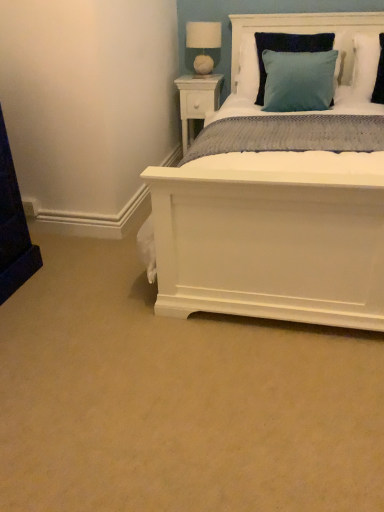
What do you see at coordinates (288, 49) in the screenshot? I see `teal velvet pillow at upper right, placed as the second pillow when sorted from right to left` at bounding box center [288, 49].

Where is `white wood nightstand at upper center`? The image size is (384, 512). white wood nightstand at upper center is located at coordinates (197, 101).

Locate an element on the screen. teal fabric pillow at upper right, placed as the 2th pillow when sorted from left to right is located at coordinates (368, 69).

From a real-world perspective, does white fabric-covered lampshade at upper center stand above teal fabric pillow at upper right, positioned as the first pillow in right-to-left order?

Yes, from a real-world perspective, white fabric-covered lampshade at upper center is on top of teal fabric pillow at upper right, positioned as the first pillow in right-to-left order.

Could you measure the distance between white fabric-covered lampshade at upper center and teal fabric pillow at upper right, placed as the 2th pillow when sorted from left to right?

3.38 feet.

Based on the photo, considering the positions of objects white fabric-covered lampshade at upper center and teal fabric pillow at upper right, placed as the 2th pillow when sorted from left to right, in the image provided, who is more to the left, white fabric-covered lampshade at upper center or teal fabric pillow at upper right, placed as the 2th pillow when sorted from left to right,?

white fabric-covered lampshade at upper center is more to the left.

Could you tell me if white wood nightstand at upper center is turned towards teal fabric pillow at upper right, placed as the 2th pillow when sorted from left to right?

No, white wood nightstand at upper center is not turned towards teal fabric pillow at upper right, placed as the 2th pillow when sorted from left to right.

From the image's perspective, which object appears higher, white wood nightstand at upper center or teal fabric pillow at upper right, positioned as the first pillow in right-to-left order?

teal fabric pillow at upper right, positioned as the first pillow in right-to-left order, from the image's perspective.

Which of these two, white wood nightstand at upper center or teal fabric pillow at upper right, placed as the 2th pillow when sorted from left to right, stands taller?

white wood nightstand at upper center is taller.

At what (x,y) coordinates should I click in order to perform the action: click on table lamp above the white wood headboard at upper center (from the image's perspective). Please return your answer as a coordinate pair (x, y). This screenshot has height=512, width=384. Looking at the image, I should click on (203, 42).

Between white wood headboard at upper center and white fabric-covered lampshade at upper center, which one is positioned in front?

white wood headboard at upper center is more forward.

Is point (315, 19) positioned in front of point (217, 23)?

That is True.

From the image's perspective, is white wood nightstand at upper center above white wood headboard at upper center?

Incorrect, from the image's perspective, white wood nightstand at upper center is lower than white wood headboard at upper center.

Could you tell me if white wood nightstand at upper center is turned towards white wood headboard at upper center?

No, white wood nightstand at upper center is not turned towards white wood headboard at upper center.

Consider the image. Considering the relative sizes of white wood nightstand at upper center and white wood headboard at upper center in the image provided, is white wood nightstand at upper center shorter than white wood headboard at upper center?

Incorrect, the height of white wood nightstand at upper center does not fall short of that of white wood headboard at upper center.

Locate an element on the screen. This screenshot has width=384, height=512. pillow that is the 2nd object located below the white fabric-covered lampshade at upper center (from the image's perspective) is located at coordinates (288, 49).

Is teal velvet pillow at upper right, which appears as the 1th pillow when viewed from the left, outside of white fabric-covered lampshade at upper center?

teal velvet pillow at upper right, which appears as the 1th pillow when viewed from the left, lies outside white fabric-covered lampshade at upper center's area.

What's the angular difference between teal velvet pillow at upper right, which appears as the 1th pillow when viewed from the left, and white fabric-covered lampshade at upper center's facing directions?

1.78 degrees separate the facing orientations of teal velvet pillow at upper right, which appears as the 1th pillow when viewed from the left, and white fabric-covered lampshade at upper center.

Does teal velvet pillow at upper right, which appears as the 1th pillow when viewed from the left, have a smaller size compared to white fabric-covered lampshade at upper center?

Incorrect, teal velvet pillow at upper right, which appears as the 1th pillow when viewed from the left, is not smaller in size than white fabric-covered lampshade at upper center.

Considering the relative positions of teal fabric pillow at upper right, positioned as the first pillow in right-to-left order, and white wood nightstand at upper center in the image provided, is teal fabric pillow at upper right, positioned as the first pillow in right-to-left order, in front of white wood nightstand at upper center?

Yes, the depth of teal fabric pillow at upper right, positioned as the first pillow in right-to-left order, is less than that of white wood nightstand at upper center.

From the image's perspective, which object appears higher, teal fabric pillow at upper right, positioned as the first pillow in right-to-left order, or white wood nightstand at upper center?

teal fabric pillow at upper right, positioned as the first pillow in right-to-left order.

Where is `pillow lying above the white wood nightstand at upper center (from the image's perspective)`? The image size is (384, 512). pillow lying above the white wood nightstand at upper center (from the image's perspective) is located at coordinates (368, 69).

Between point (357, 42) and point (213, 104), which one is positioned behind?

The point (213, 104) is more distant.

Does teal velvet pillow at upper right, which appears as the 1th pillow when viewed from the left, turn towards white wood headboard at upper center?

No, teal velvet pillow at upper right, which appears as the 1th pillow when viewed from the left, is not aimed at white wood headboard at upper center.

Can you confirm if teal velvet pillow at upper right, placed as the second pillow when sorted from right to left, is taller than white wood headboard at upper center?

No.

Is teal velvet pillow at upper right, which appears as the 1th pillow when viewed from the left, next to white wood headboard at upper center?

No, teal velvet pillow at upper right, which appears as the 1th pillow when viewed from the left, is not beside white wood headboard at upper center.

From the image's perspective, between teal velvet pillow at upper right, placed as the second pillow when sorted from right to left, and white wood headboard at upper center, who is located below?

teal velvet pillow at upper right, placed as the second pillow when sorted from right to left, is shown below in the image.

From a real-world perspective, which pillow is the 1st one underneath the white fabric-covered lampshade at upper center? Please provide its 2D coordinates.

[(368, 69)]

Identify the location of pillow above the white wood nightstand at upper center (from the image's perspective). (368, 69).

Based on their spatial positions, is teal fabric pillow at upper right, placed as the 2th pillow when sorted from left to right, or teal velvet pillow at upper right, which appears as the 1th pillow when viewed from the left, closer to white fabric-covered lampshade at upper center?

Among the two, teal velvet pillow at upper right, which appears as the 1th pillow when viewed from the left, is located nearer to white fabric-covered lampshade at upper center.

Looking at the image, which one is located closer to teal fabric pillow at upper right, placed as the 2th pillow when sorted from left to right, white wood nightstand at upper center or teal velvet pillow at upper right, placed as the second pillow when sorted from right to left?

teal velvet pillow at upper right, placed as the second pillow when sorted from right to left, is closer to teal fabric pillow at upper right, placed as the 2th pillow when sorted from left to right.

When comparing their distances from white wood headboard at upper center, does teal fabric pillow at upper right, positioned as the first pillow in right-to-left order, or teal velvet pillow at upper right, placed as the second pillow when sorted from right to left, seem further?

teal velvet pillow at upper right, placed as the second pillow when sorted from right to left, is positioned further to the anchor white wood headboard at upper center.

From the image, which object appears to be farther from teal fabric pillow at upper right, placed as the 2th pillow when sorted from left to right, white fabric-covered lampshade at upper center or teal velvet pillow at upper right, which appears as the 1th pillow when viewed from the left?

white fabric-covered lampshade at upper center lies further to teal fabric pillow at upper right, placed as the 2th pillow when sorted from left to right, than the other object.

From the image, which object appears to be farther from white fabric-covered lampshade at upper center, teal velvet pillow at upper right, placed as the second pillow when sorted from right to left, or white wood headboard at upper center?

teal velvet pillow at upper right, placed as the second pillow when sorted from right to left, is further to white fabric-covered lampshade at upper center.

Estimate the real-world distances between objects in this image. Which object is further from white fabric-covered lampshade at upper center, white wood nightstand at upper center or teal velvet pillow at upper right, placed as the second pillow when sorted from right to left?

teal velvet pillow at upper right, placed as the second pillow when sorted from right to left, is further to white fabric-covered lampshade at upper center.

Looking at the image, which one is located further to teal velvet pillow at upper right, which appears as the 1th pillow when viewed from the left, white wood nightstand at upper center or white wood headboard at upper center?

white wood nightstand at upper center is positioned further to the anchor teal velvet pillow at upper right, which appears as the 1th pillow when viewed from the left.

Based on the photo, based on their spatial positions, is white fabric-covered lampshade at upper center or teal fabric pillow at upper right, positioned as the first pillow in right-to-left order, closer to white wood nightstand at upper center?

white fabric-covered lampshade at upper center is positioned closer to the anchor white wood nightstand at upper center.

Identify the location of headboard located between teal velvet pillow at upper right, placed as the second pillow when sorted from right to left, and white fabric-covered lampshade at upper center in the depth direction. Image resolution: width=384 pixels, height=512 pixels. click(x=307, y=32).

Locate an element on the screen. The width and height of the screenshot is (384, 512). pillow between white fabric-covered lampshade at upper center and teal fabric pillow at upper right, positioned as the first pillow in right-to-left order, from left to right is located at coordinates (288, 49).

Locate an element on the screen. The image size is (384, 512). pillow between white wood nightstand at upper center and teal fabric pillow at upper right, placed as the 2th pillow when sorted from left to right, from left to right is located at coordinates (288, 49).

What are the coordinates of `headboard located between white fabric-covered lampshade at upper center and teal fabric pillow at upper right, positioned as the first pillow in right-to-left order, in the left-right direction` in the screenshot? It's located at (307, 32).